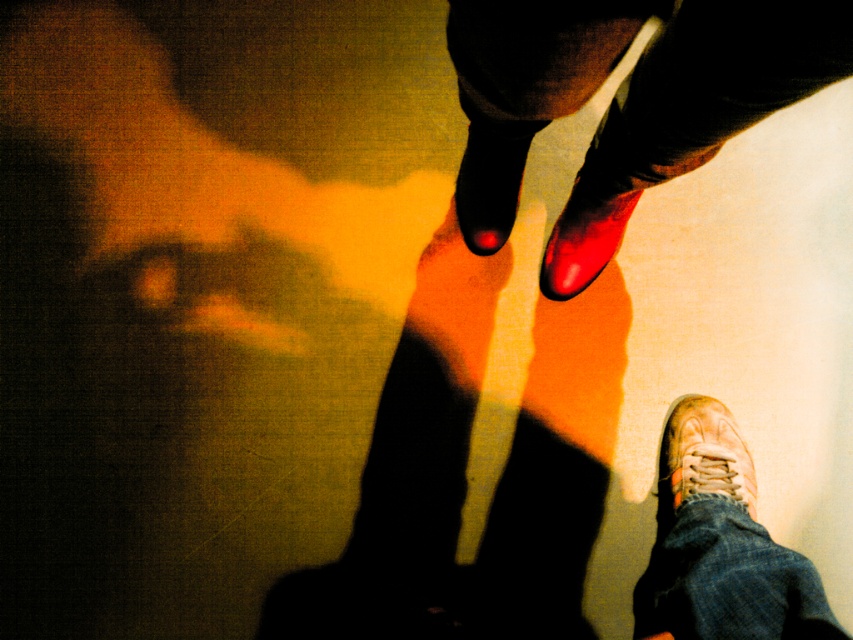
You are a shoe designer trying to create a new line of shoes. You observe the shiny red shoe at center and the shiny black shoe at center in the image. Which shoe has a greater width according to the description?

The shiny red shoe at center has a greater width than the shiny black shoe at center as stated in the description.

You are standing at the point with coordinates point (581, 179) and want to walk towards the point with coordinates point (840, 8). Which direction should you face to move directly towards it?

You should face towards the direction of point (840, 8) because it is in front of point (581, 179).

You are standing on a surface and see the shiny red nail polish at center. Can you reach it without moving your feet?

The shiny red nail polish at center is located at point coordinates that are not provided in the Scene or Objects Description, so I cannot determine its exact position relative to your current stance. However, since it is described as being at the center, it might be within reach depending on your arm length and positioning.